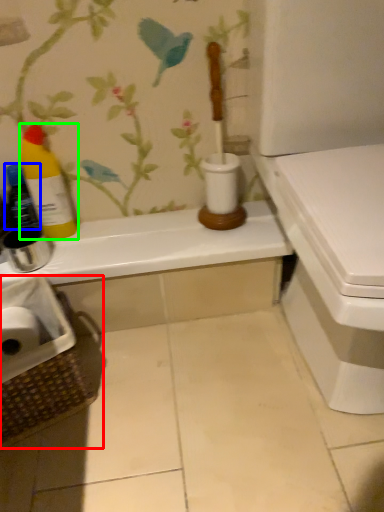
Question: Considering the real-world distances, which object is closest to laundry basket (highlighted by a red box)? bottle (highlighted by a blue box) or bottle (highlighted by a green box).

Choices:
 (A) bottle
 (B) bottle

Answer: (B)